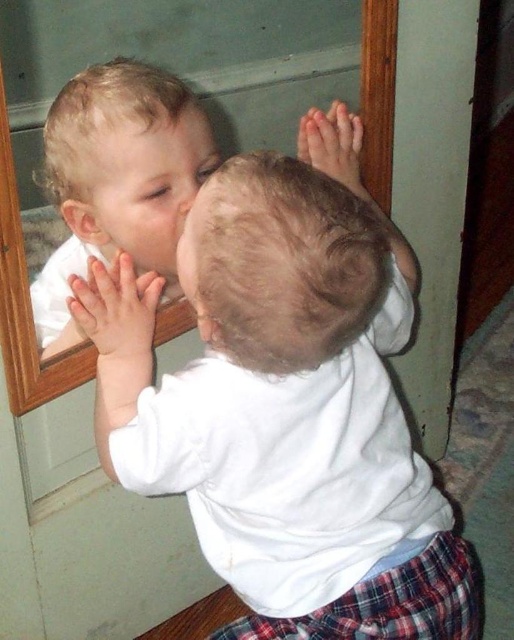
Image resolution: width=514 pixels, height=640 pixels. What do you see at coordinates (25, 301) in the screenshot? I see `wooden mirror at upper center` at bounding box center [25, 301].

Between wooden mirror at upper center and smooth skin nose at center, which one appears on the right side from the viewer's perspective?

Positioned to the right is smooth skin nose at center.

Does point (8, 285) come closer to viewer compared to point (196, 186)?

That is True.

You are a GUI agent. You are given a task and a screenshot of the screen. Output one action in this format:
    pyautogui.click(x=<x>, y=<y>)
    Task: Click on the wooden mirror at upper center
    Image resolution: width=514 pixels, height=640 pixels.
    Given the screenshot: What is the action you would take?
    pyautogui.click(x=25, y=301)

Can you confirm if white soft baby at center is positioned to the left of smooth white shirt at center?

In fact, white soft baby at center is to the right of smooth white shirt at center.

Who is shorter, white soft baby at center or smooth white shirt at center?

smooth white shirt at center is shorter.

Which is in front, point (303, 227) or point (71, 106)?

Positioned in front is point (303, 227).

Locate an element on the screen. This screenshot has width=514, height=640. white soft baby at center is located at coordinates (286, 401).

Can you confirm if smooth white shirt at center is positioned to the left of smooth skin face at upper left?

Indeed, smooth white shirt at center is positioned on the left side of smooth skin face at upper left.

Does smooth white shirt at center appear on the right side of smooth skin face at upper left?

In fact, smooth white shirt at center is to the left of smooth skin face at upper left.

Is point (124, 236) positioned after point (160, 145)?

That is True.

Image resolution: width=514 pixels, height=640 pixels. I want to click on smooth white shirt at center, so click(x=118, y=179).